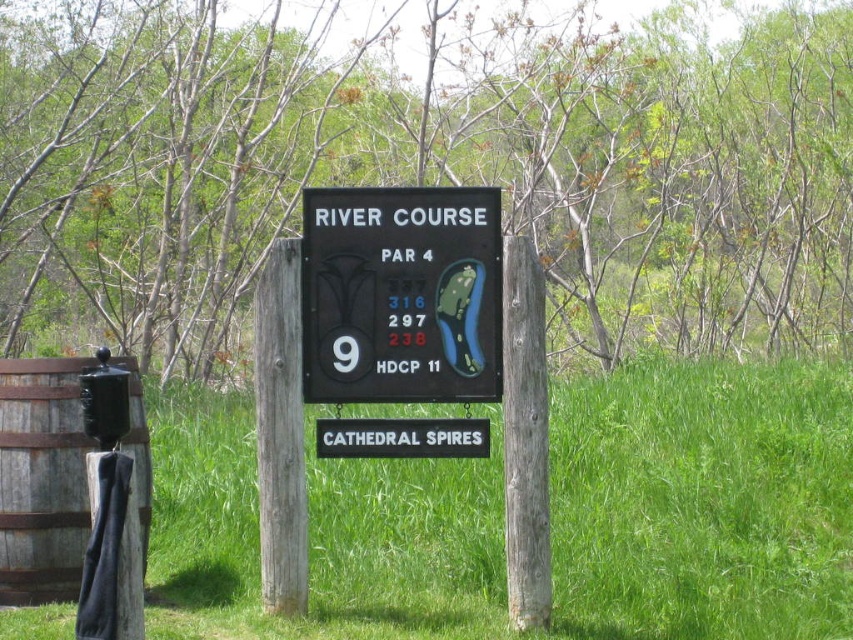
You are a golfer standing at the tee of hole number 9 on the RIVER COURSE. You see the green grass at center and the black plastic sign at center. Which object is located below the other?

The green grass at center is positioned under the black plastic sign at center, meaning the green grass at center is below the black plastic sign at center.

You are a golfer standing on the green grass at center and want to hit the white plastic sign at center. Considering the height difference between them, will the sign be visible above the grass when you take your shot?

The green grass at center has a greater height compared to the white plastic sign at center, so the sign may be partially or fully obscured by the grass, making it less visible when taking the shot.

You are a golfer standing in front of the RIVER COURSE signboard. You need to choose between the brown rough wood post at center and the white plastic sign at center to place your scorecard. Which object should you place it on if you want it to be closer to your eyes?

The brown rough wood post at center is above the white plastic sign at center, so placing the scorecard on the brown rough wood post at center would position it closer to your eyes.